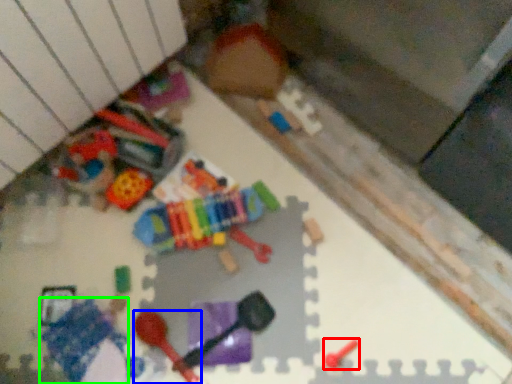
Question: Estimate the real-world distances between objects in this image. Which object is farther from toy (highlighted by a red box), toy (highlighted by a blue box) or toy (highlighted by a green box)?

Choices:
 (A) toy
 (B) toy

Answer: (B)